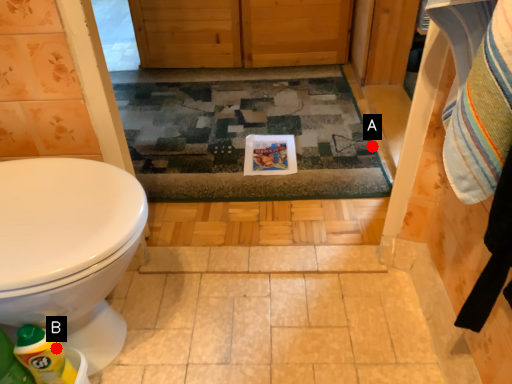
Question: Two points are circled on the image, labeled by A and B beside each circle. Which point appears closest to the camera in this image?

Choices:
 (A) A is closer
 (B) B is closer

Answer: (B)